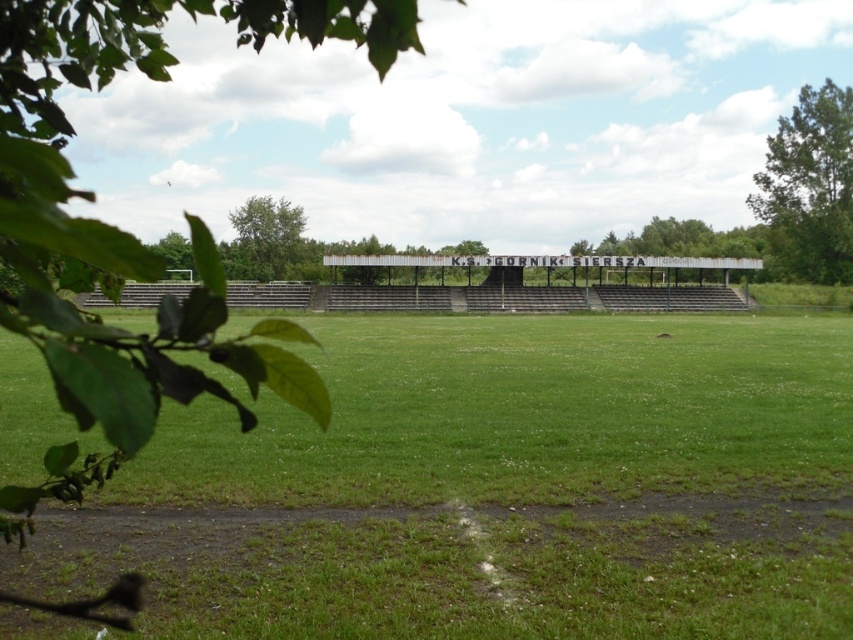
You are a photographer taking a picture of the green grass field at center and the green leafy tree at upper right. Which object will appear larger in your photo?

The green grass field at center will appear larger in the photo because it is closer to the viewer than the green leafy tree at upper right.

You are a photographer planning to take a picture of the green grass field at center and the green leafy tree at upper left. Which object should you focus on first if you want to capture both in a single frame without moving the camera?

The green grass field at center is located below green leafy tree at upper left, so you should focus on the green leafy tree at upper left first as it is higher up in the frame, then adjust to include the lower positioned green grass field at center.